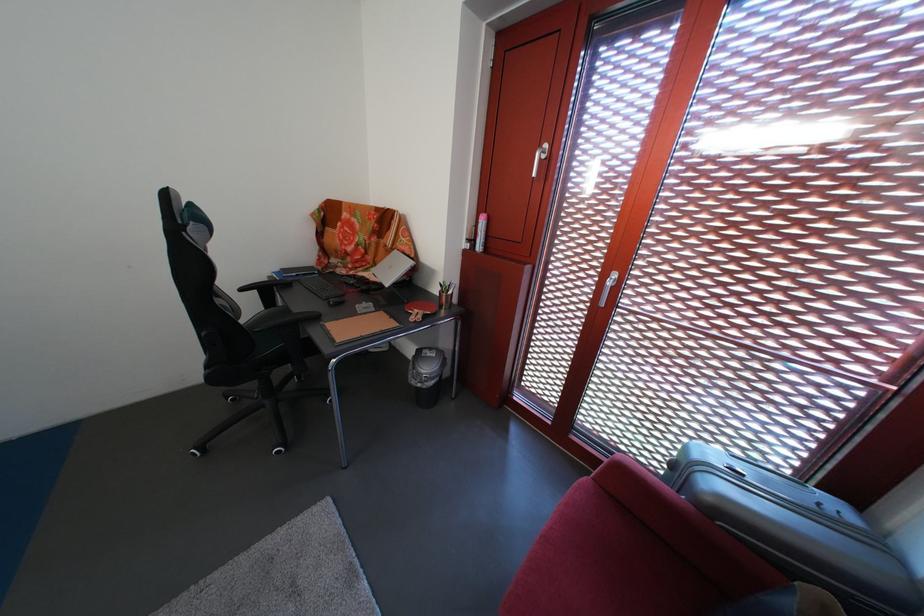
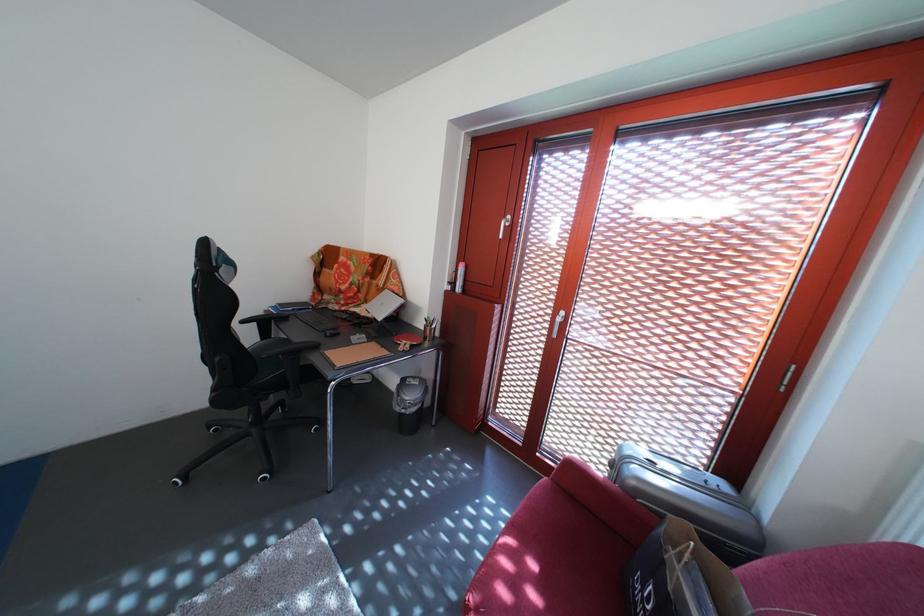
Question: Based on the continuous images, in which direction is the camera rotating? Reply with the corresponding letter.

Choices:
 (A) Left
 (B) Right
 (C) Up
 (D) Down

Answer: (C)